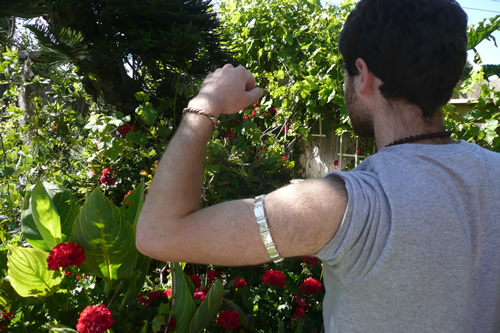
At what (x,y) coordinates should I click in order to perform the action: click on white wall. Please return your answer as a coordinate pair (x, y). This screenshot has width=500, height=333. Looking at the image, I should click on click(x=315, y=162).